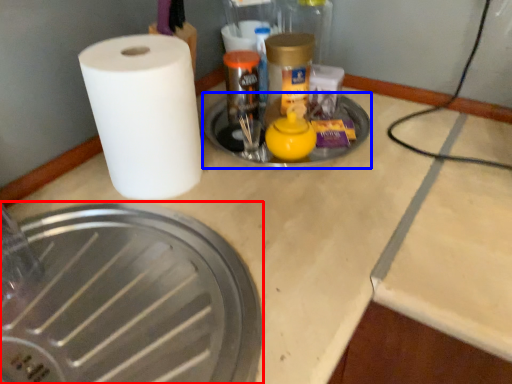
Question: Which object is closer to the camera taking this photo, manhole cover (highlighted by a red box) or manhole cover (highlighted by a blue box)?

Choices:
 (A) manhole cover
 (B) manhole cover

Answer: (A)